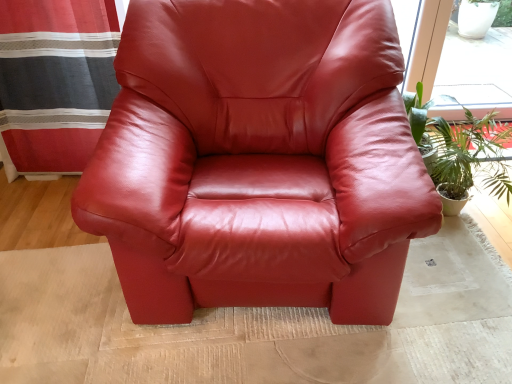
Find the location of a particular element. This screenshot has width=512, height=384. free spot below green leafy plant at right (from a real-world perspective) is located at coordinates (470, 228).